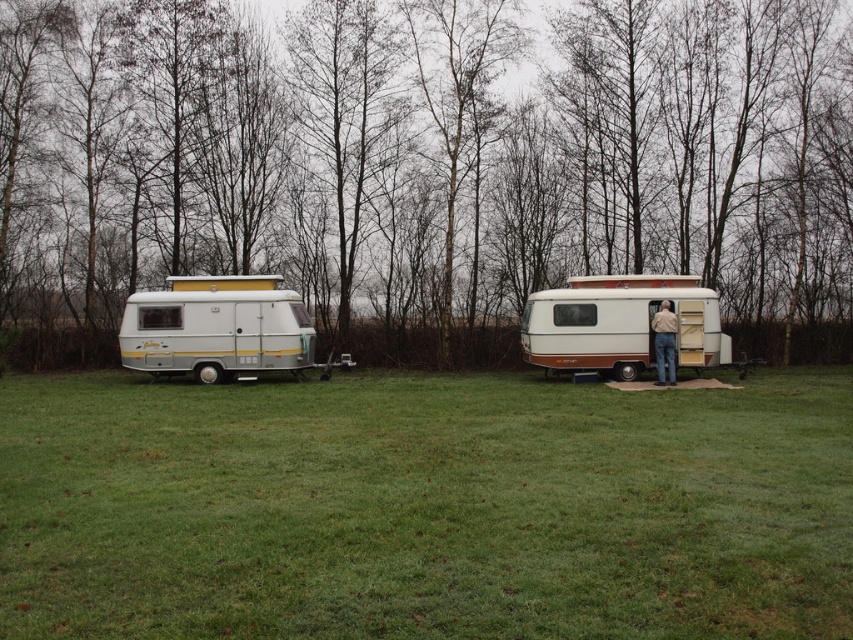
You are planning to park a tall delivery truck between the silver metallic camper at left and the brown textured caravan at center. Considering their heights, which caravan should you avoid parking near to ensure the truck doesn t hit anything?

You should avoid parking the tall delivery truck near the brown textured caravan at center because it has a greater height than the silver metallic camper at left, making it more likely to be struck by the truck.